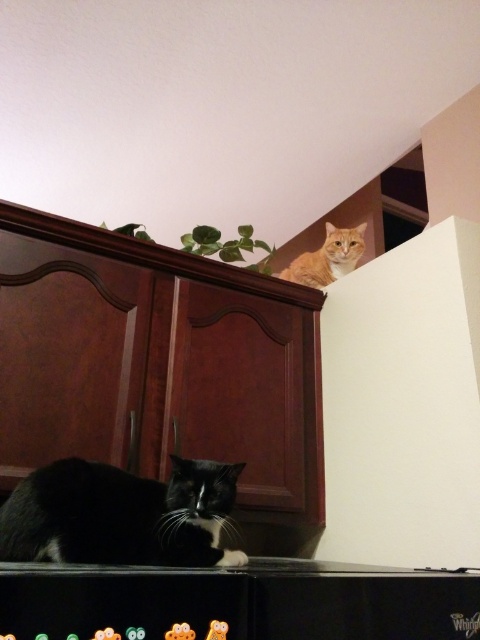
Which is above, brown wood dresser at center or black fur cat at lower left?

brown wood dresser at center is higher up.

Between point (132, 250) and point (99, 518), which one is positioned behind?

Positioned behind is point (132, 250).

Is point (41, 440) positioned behind point (155, 484)?

Yes, point (41, 440) is farther from viewer.

What are the coordinates of `brown wood dresser at center` in the screenshot? It's located at (157, 364).

Is brown wood dresser at center shorter than orange fur cat at upper right?

In fact, brown wood dresser at center may be taller than orange fur cat at upper right.

Is point (90, 349) closer to viewer compared to point (346, 232)?

Yes, point (90, 349) is in front of point (346, 232).

Which is in front, point (262, 282) or point (311, 262)?

Point (262, 282)

Locate an element on the screen. brown wood dresser at center is located at coordinates tap(157, 364).

In the scene shown: Is black fur cat at lower left to the right of orange fur cat at upper right from the viewer's perspective?

Incorrect, black fur cat at lower left is not on the right side of orange fur cat at upper right.

Between point (110, 528) and point (307, 253), which one is positioned behind?

Point (307, 253)

Is point (40, 516) closer to viewer compared to point (338, 257)?

Yes.

I want to click on black fur cat at lower left, so click(x=120, y=515).